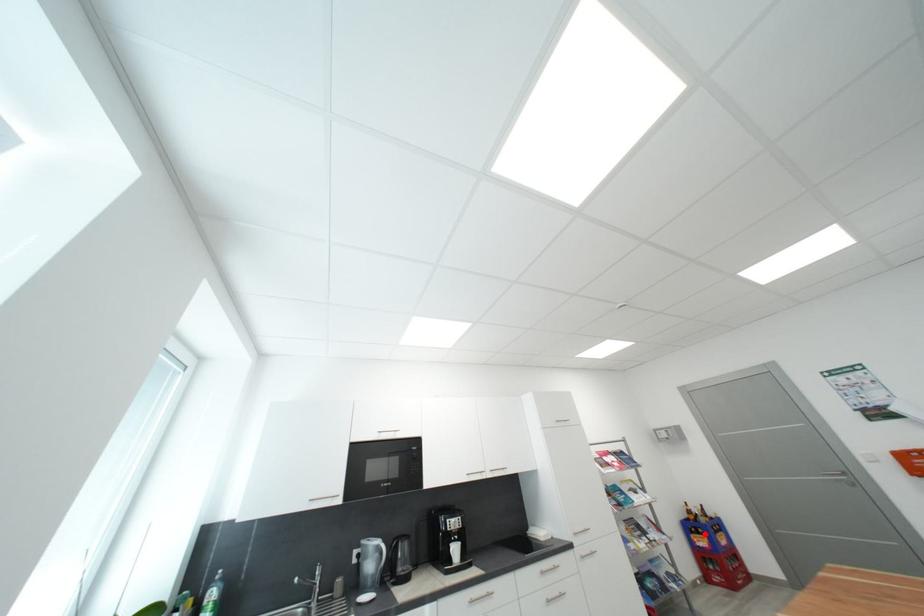
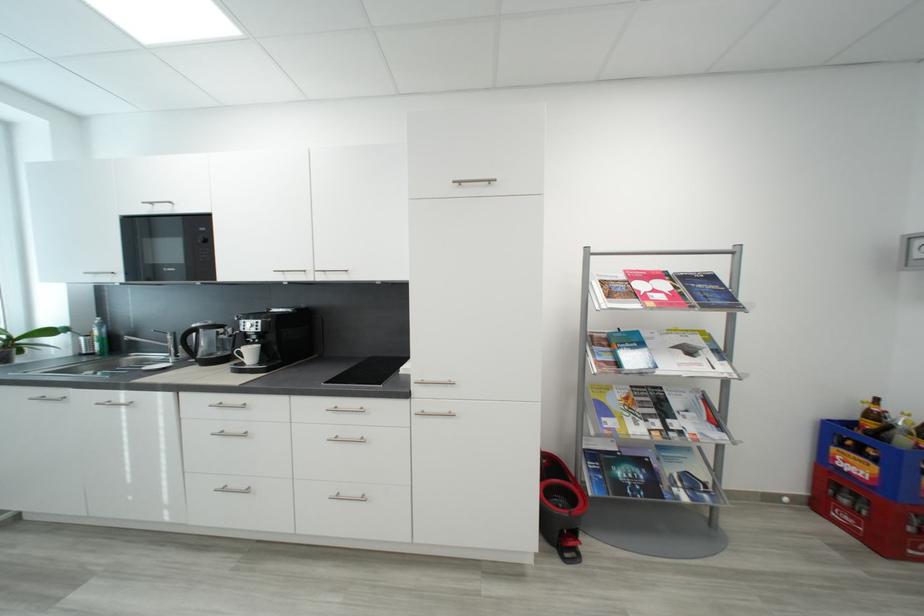
Locate, in the second image, the point that corresponds to the highlighted location in the first image.

(867, 454)